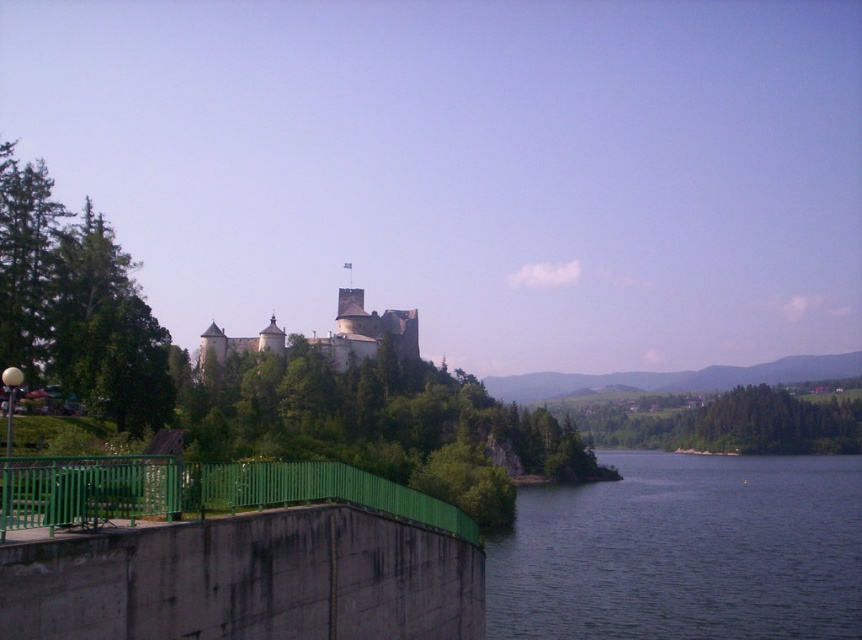
Question: Which of the following is the closest to the observer?

Choices:
 (A) dark blue water at lower right
 (B) stone castle at center

Answer: (A)

Question: Considering the real-world distances, which object is farthest from the dark blue water at lower right?

Choices:
 (A) stone castle at center
 (B) green metallic fence at lower left

Answer: (B)

Question: Does dark blue water at lower right appear on the right side of green metallic fence at lower left?

Choices:
 (A) yes
 (B) no

Answer: (A)

Question: Which point is closer to the camera taking this photo?

Choices:
 (A) (380, 316)
 (B) (839, 596)

Answer: (B)

Question: Can you confirm if green metallic fence at lower left is bigger than stone castle at center?

Choices:
 (A) no
 (B) yes

Answer: (A)

Question: Is green metallic fence at lower left positioned behind stone castle at center?

Choices:
 (A) no
 (B) yes

Answer: (A)